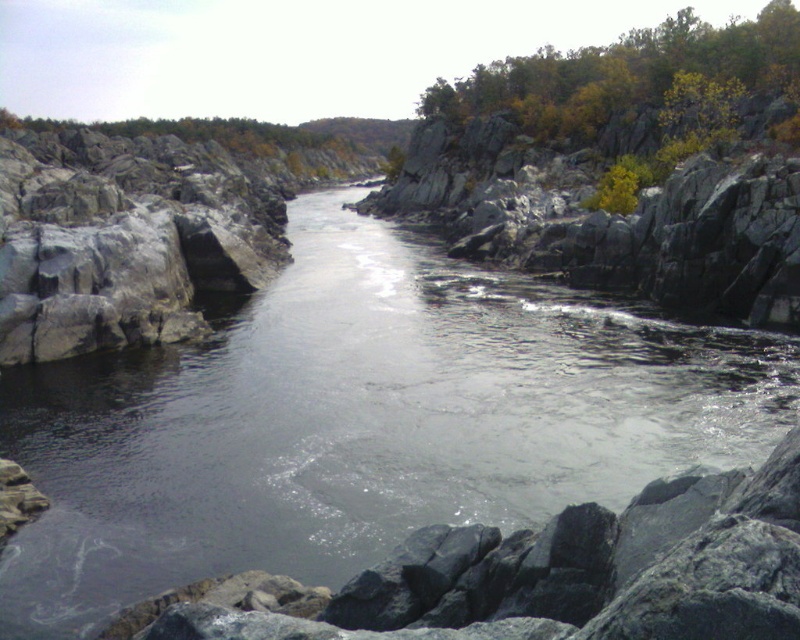
You are standing at the edge of the river and want to place a small marker at both point (486, 337) and point (550, 128). Which point will require you to walk further away from your current position to reach?

Point (550, 128) is further from the viewer than point (486, 337), so you will need to walk further away from your current position to reach point (550, 128).